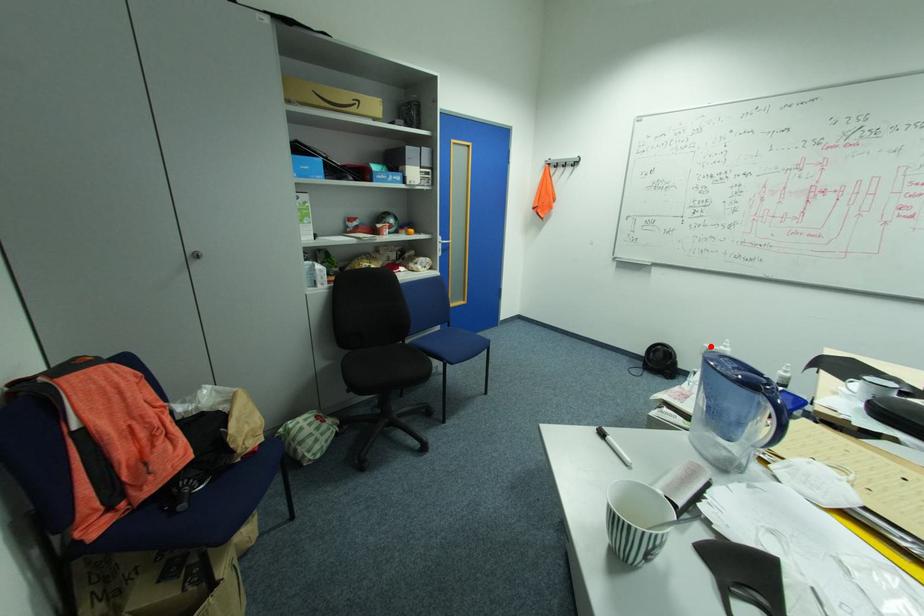
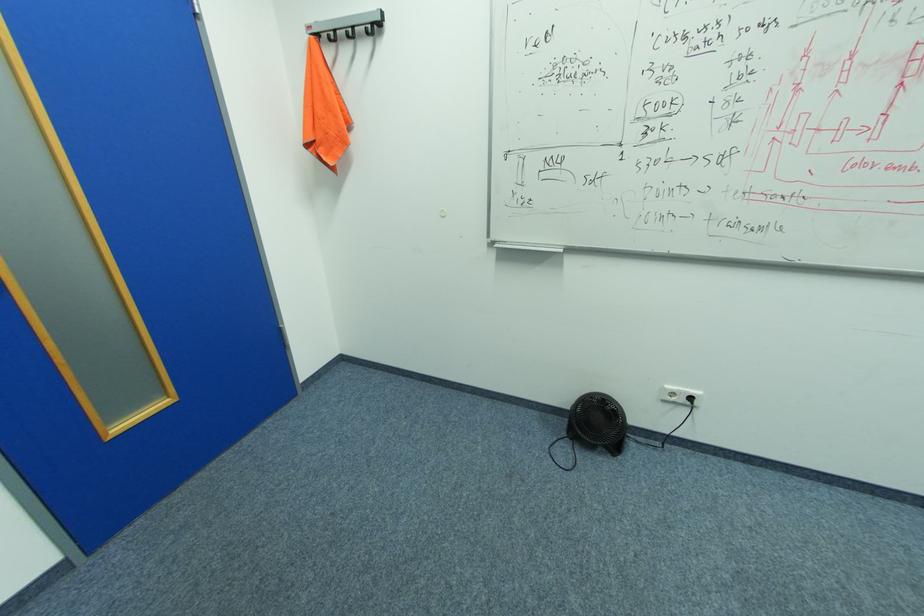
Question: I am providing you with two images of the same scene from different viewpoints. A red point is marked on the first image. Can you still see the location of the red point in image 2?

Choices:
 (A) Yes
 (B) No

Answer: (A)